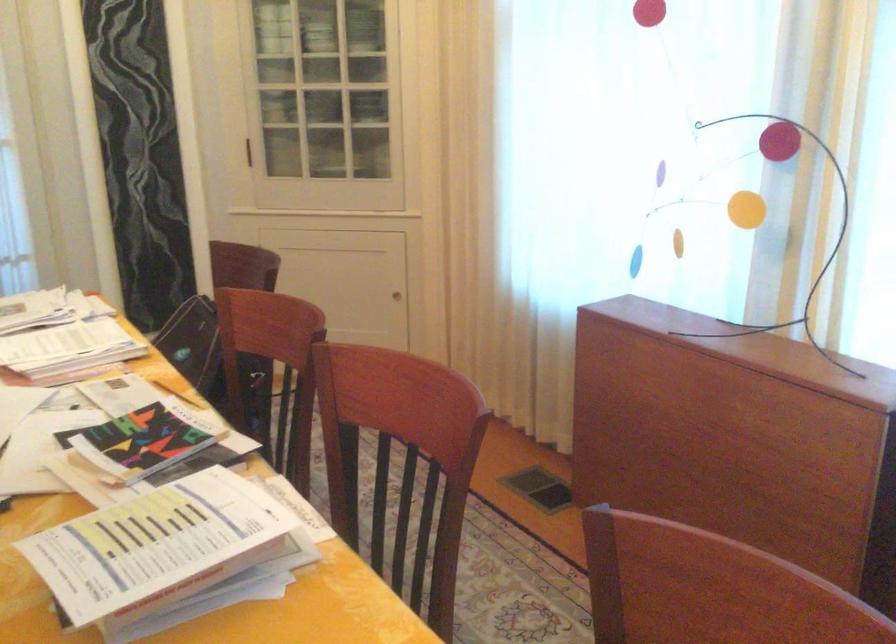
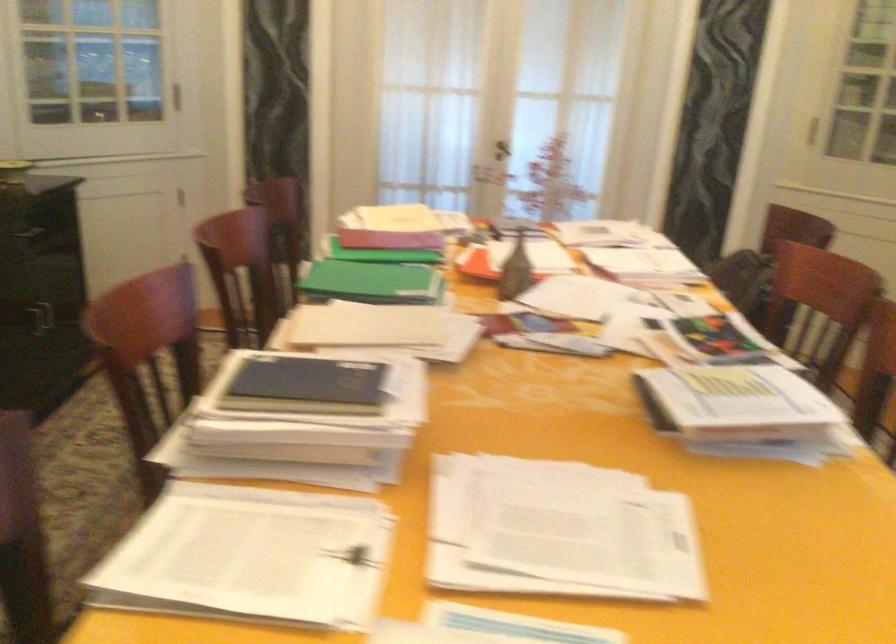
Question: The camera is either moving clockwise (left) or counter-clockwise (right) around the object. The first image is from the beginning of the video and the second image is from the end. Is the camera moving left or right when shooting the video?

Choices:
 (A) Left
 (B) Right

Answer: (B)